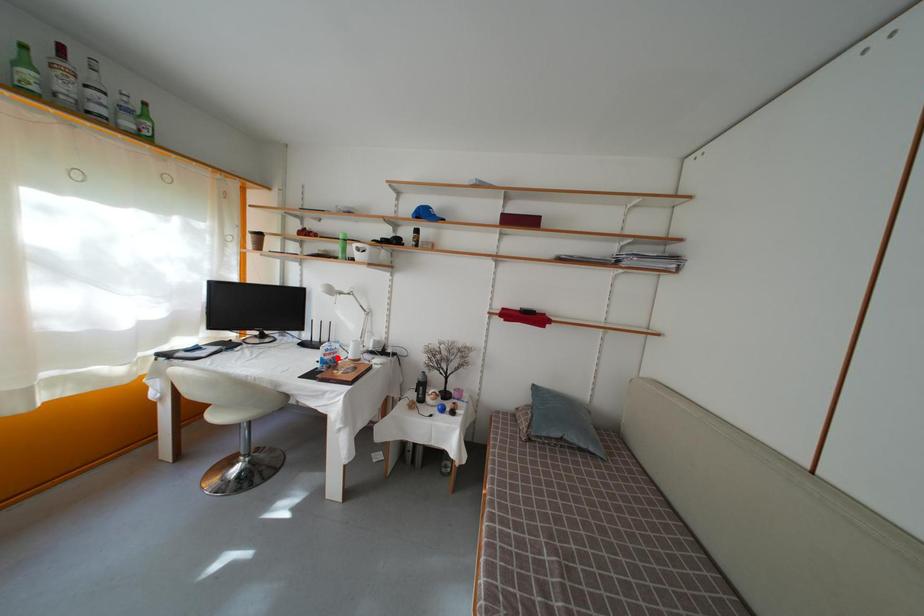
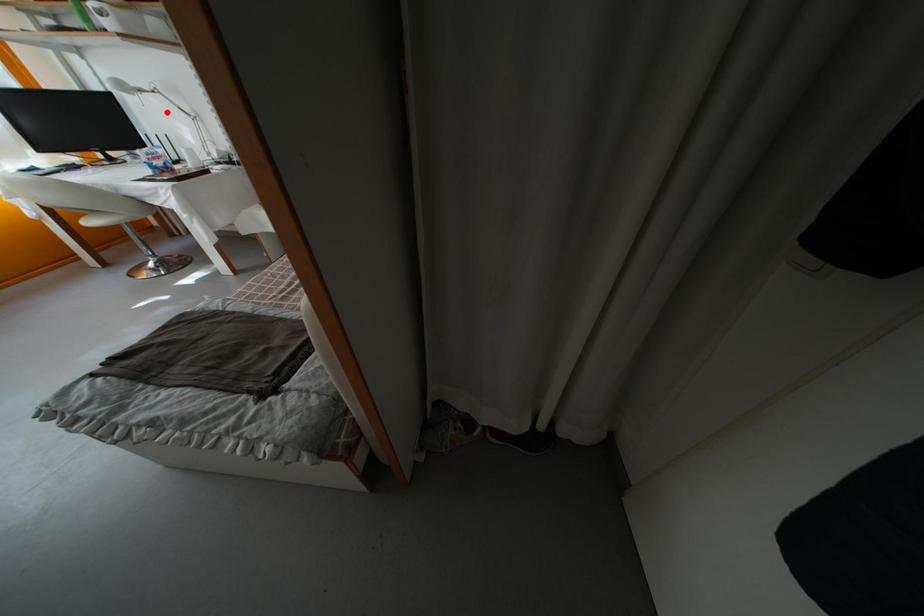
I am providing you with two images of the same scene from different viewpoints. A red point is marked on the first image and another point is marked on the second image. Are the points marked in image1 and image2 representing the same 3D position?

No